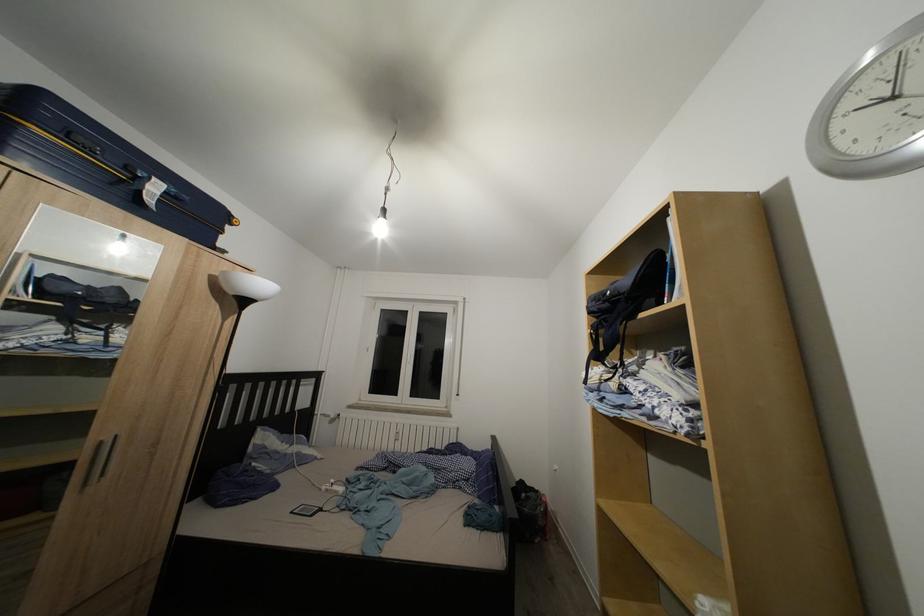
Where is `blue backpack`? The image size is (924, 616). blue backpack is located at coordinates (623, 306).